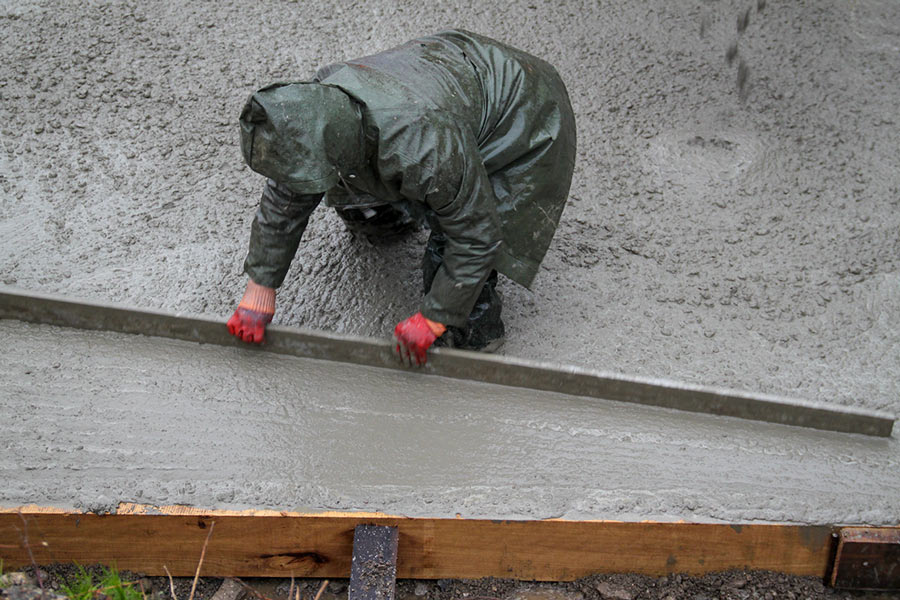
Where is `screed board`? The height and width of the screenshot is (600, 900). screed board is located at coordinates (245, 350).